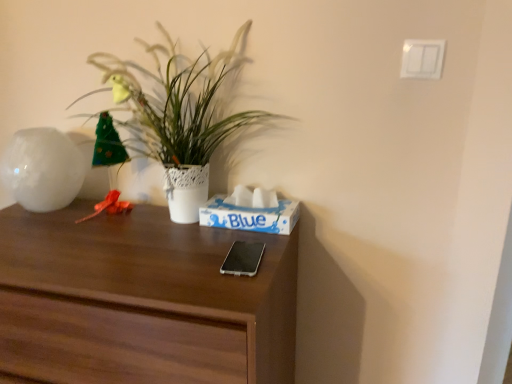
The image size is (512, 384). I want to click on empty space that is ontop of dark wood desk at center (from a real-world perspective), so click(x=91, y=235).